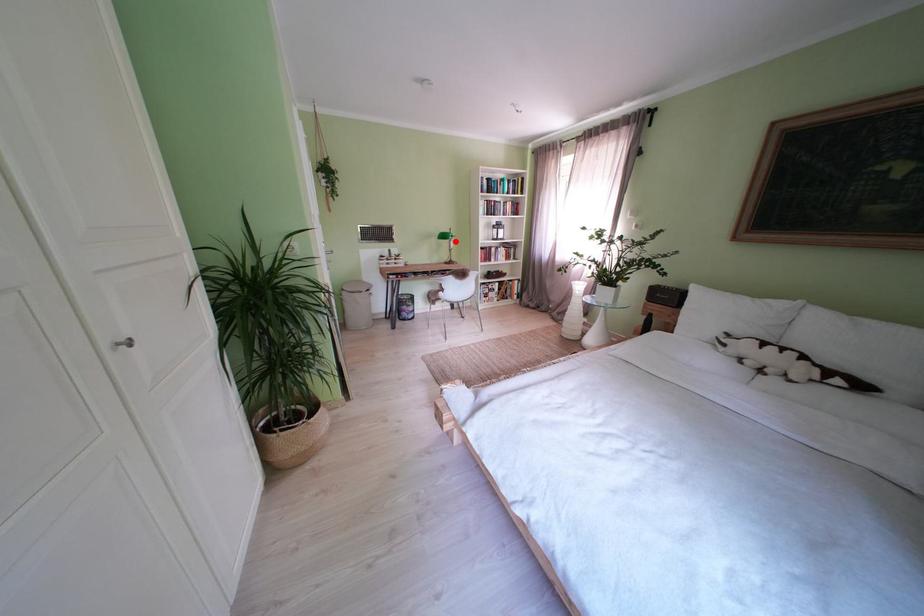
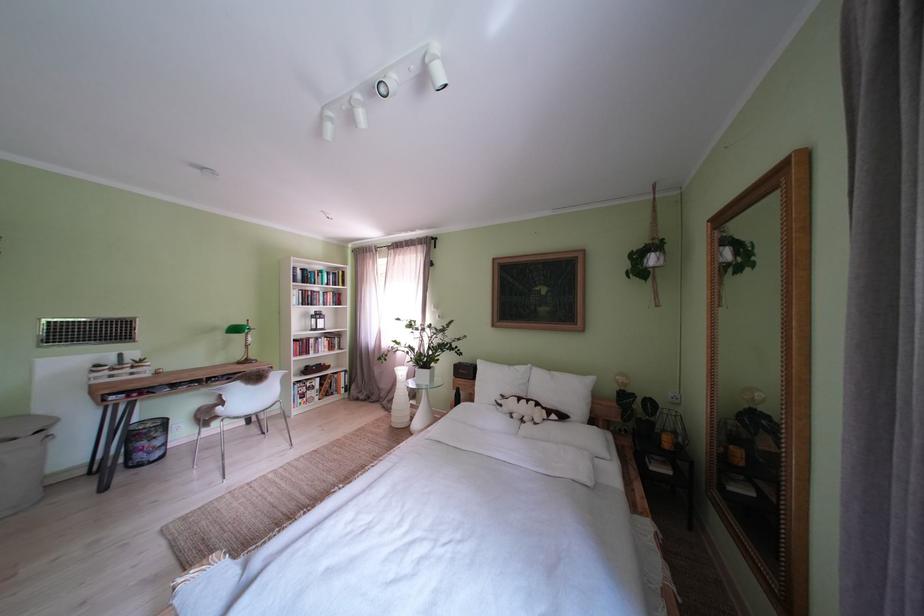
The point at the highlighted location is marked in the first image. Where is the corresponding point in the second image?

(247, 334)